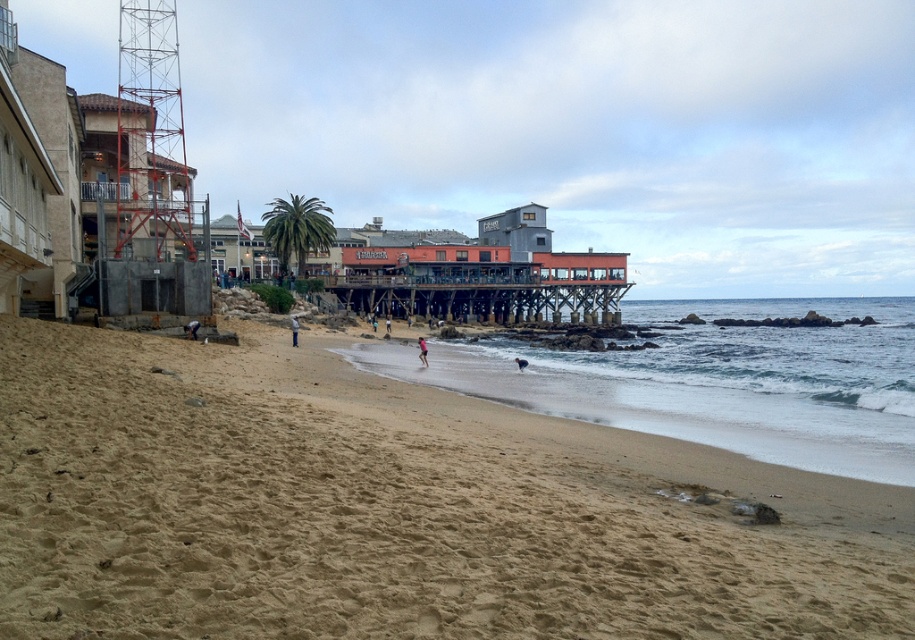
Question: Does brown sandy beach at center have a larger size compared to blue jeans at center?

Choices:
 (A) yes
 (B) no

Answer: (A)

Question: Which object is closer to the camera taking this photo?

Choices:
 (A) wooden pier at center
 (B) blue jeans at center

Answer: (B)

Question: Which object is farther from the camera taking this photo?

Choices:
 (A) light blue denim shorts at lower center
 (B) brown sandy beach at center
 (C) light blue fabric at center

Answer: (C)

Question: Which point is closer to the camera?

Choices:
 (A) (196, 337)
 (B) (293, 332)
 (C) (422, 349)
 (D) (519, 362)

Answer: (A)

Question: Is blue jeans at center to the left of light pink fabric at center from the viewer's perspective?

Choices:
 (A) yes
 (B) no

Answer: (A)

Question: Is brown sandy beach at center to the right of light pink fabric at center from the viewer's perspective?

Choices:
 (A) no
 (B) yes

Answer: (B)